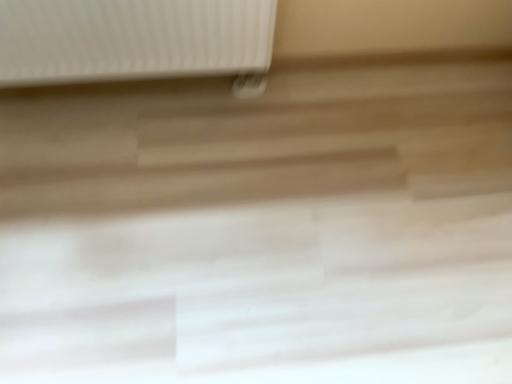
The image size is (512, 384). Find the location of `vacant area that is in front of white ribbed radiator at upper left`. vacant area that is in front of white ribbed radiator at upper left is located at coordinates (125, 187).